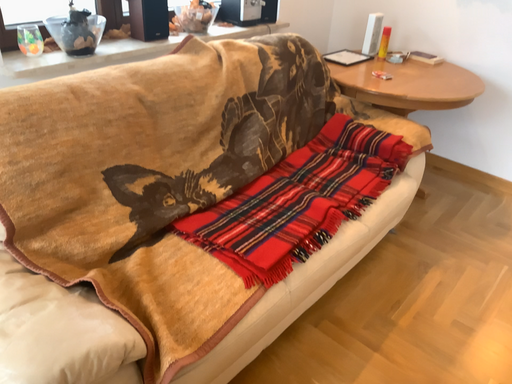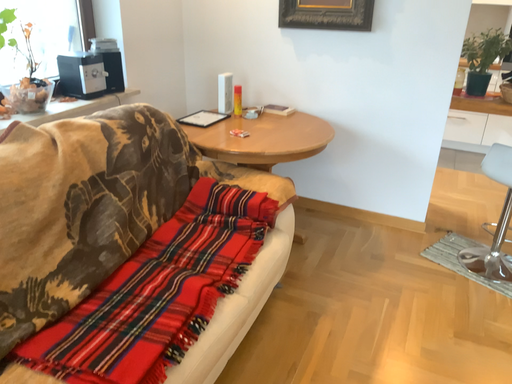
Question: Which way did the camera rotate in the video?

Choices:
 (A) rotated left
 (B) rotated right

Answer: (B)